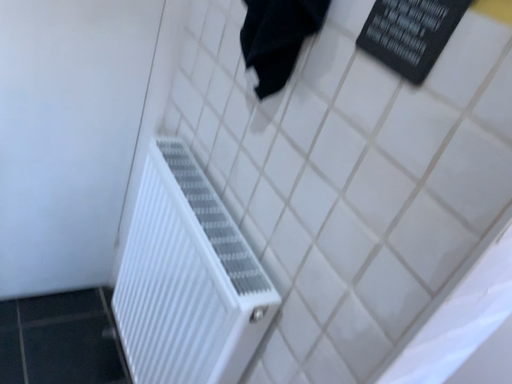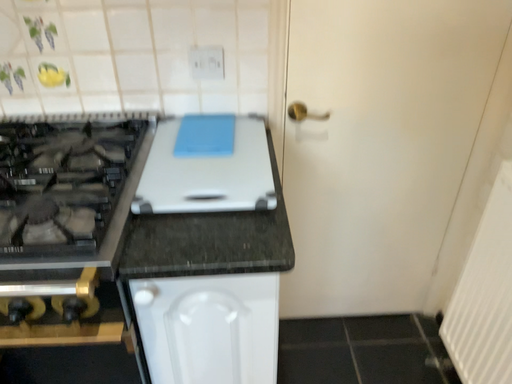
Question: Which way did the camera rotate in the video?

Choices:
 (A) rotated right
 (B) rotated left

Answer: (B)